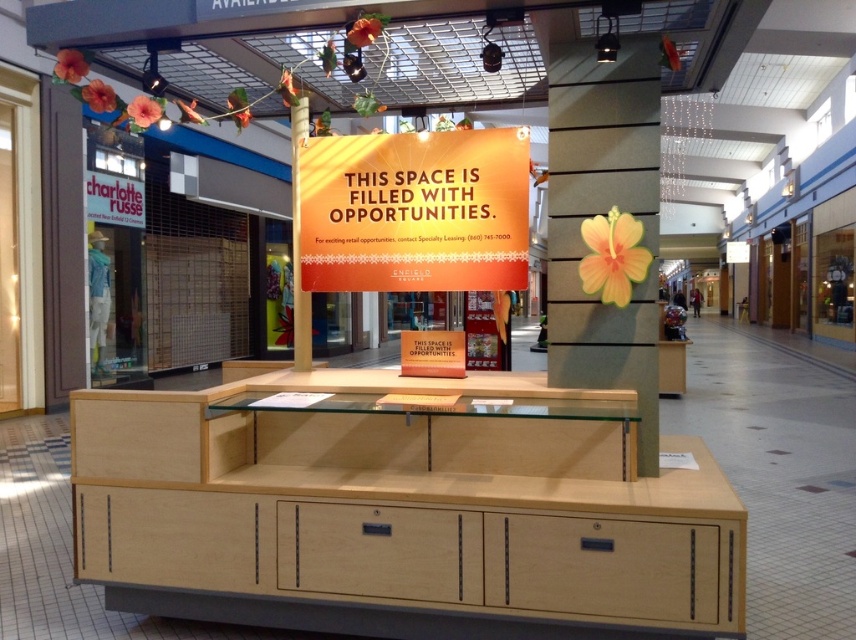
Is orange matte sign at center below wooden drawer at lower right?

No, orange matte sign at center is not below wooden drawer at lower right.

Is orange matte sign at center shorter than wooden drawer at lower right?

In fact, orange matte sign at center may be taller than wooden drawer at lower right.

The height and width of the screenshot is (640, 856). Describe the element at coordinates (414, 211) in the screenshot. I see `orange matte sign at center` at that location.

Locate an element on the screen. This screenshot has width=856, height=640. orange matte sign at center is located at coordinates (414, 211).

Is wooden drawer at lower right taller than light wood drawer at center?

Yes.

Can you confirm if wooden drawer at lower right is smaller than light wood drawer at center?

No, wooden drawer at lower right is not smaller than light wood drawer at center.

In the scene shown: Who is more distant from viewer, (627, 592) or (364, 522)?

Point (364, 522)

Where is `wooden drawer at lower right`? The width and height of the screenshot is (856, 640). wooden drawer at lower right is located at coordinates (602, 566).

Is point (569, 216) more distant than point (524, 545)?

Yes, it is behind point (524, 545).

Which is in front, point (637, 381) or point (714, 552)?

Point (714, 552) is more forward.

This screenshot has width=856, height=640. What do you see at coordinates (603, 214) in the screenshot? I see `matte gray pillar at center` at bounding box center [603, 214].

What are the coordinates of `matte gray pillar at center` in the screenshot? It's located at (603, 214).